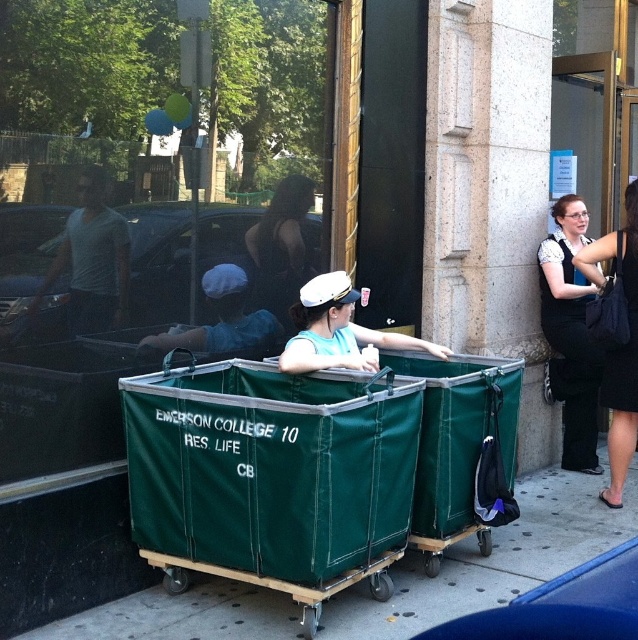
You are a delivery person who needs to choose between the green fabric trolley at center and the green fabric cart at center to carry a long package. Which one is more suitable based on their widths?

→ The green fabric trolley at center is thinner than the green fabric cart at center, so the green fabric cart at center can accommodate the long package better due to its wider width.

You are a delivery person who needs to place a matte white cap at center and a black fabric bag at right into a storage locker. The locker has a height limit of 1 meter. Can both items fit vertically without stacking?

The matte white cap at center is positioned under the black fabric bag at right, which suggests they are already arranged vertically. Since their combined height is not specified, but the description implies they can be placed under each other, it is possible they might exceed the 1 meter height limit. Without exact dimensions, we cannot confirm if both will fit without stacking.

You are standing at the center of the image. Which object is located at the point with coordinates (x=493, y=560)?

The point at (x=493, y=560) corresponds to the green fabric cart at center.